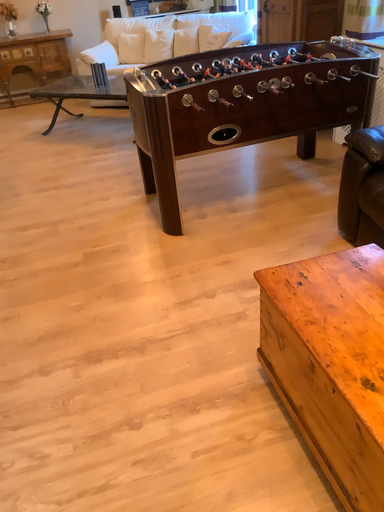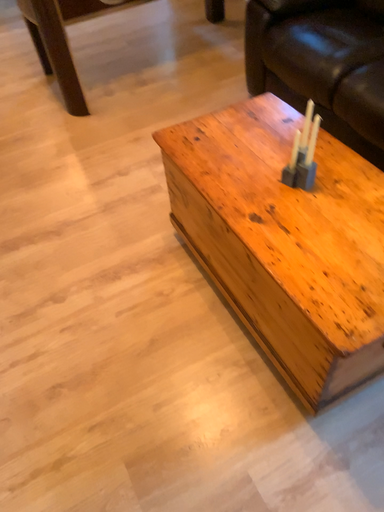
Question: How did the camera likely rotate when shooting the video?

Choices:
 (A) rotated left
 (B) rotated right

Answer: (B)